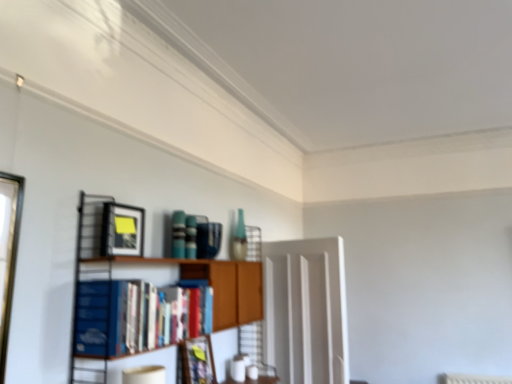
Question: Is blue hardcover book at left oriented towards matte black picture frame at upper left, which appears as the 2th picture frame when viewed from the back?

Choices:
 (A) no
 (B) yes

Answer: (A)

Question: Is blue hardcover book at left thinner than matte black picture frame at upper left, which appears as the 2th picture frame when viewed from the back?

Choices:
 (A) no
 (B) yes

Answer: (A)

Question: Considering the relative sizes of blue hardcover book at left and matte black picture frame at upper left, positioned as the 1th picture frame in left-to-right order, in the image provided, is blue hardcover book at left wider than matte black picture frame at upper left, positioned as the 1th picture frame in left-to-right order,?

Choices:
 (A) yes
 (B) no

Answer: (A)

Question: Does blue hardcover book at left lie behind matte black picture frame at upper left, positioned as the 1th picture frame in left-to-right order?

Choices:
 (A) no
 (B) yes

Answer: (A)

Question: Is blue hardcover book at left turned away from matte black picture frame at upper left, which is the 2th picture frame from right to left?

Choices:
 (A) yes
 (B) no

Answer: (B)

Question: From the image's perspective, is matte black picture frame at upper left, the 1th picture frame when ordered from front to back, positioned above or below wooden bookshelf at center?

Choices:
 (A) above
 (B) below

Answer: (A)

Question: From a real-world perspective, is matte black picture frame at upper left, positioned as the 1th picture frame in left-to-right order, above or below wooden bookshelf at center?

Choices:
 (A) above
 (B) below

Answer: (A)

Question: Is matte black picture frame at upper left, which appears as the 2th picture frame when viewed from the back, bigger or smaller than wooden bookshelf at center?

Choices:
 (A) small
 (B) big

Answer: (A)

Question: Considering their positions, is matte black picture frame at upper left, the 1th picture frame when ordered from front to back, located in front of or behind wooden bookshelf at center?

Choices:
 (A) front
 (B) behind

Answer: (B)

Question: Is point (206, 352) closer or farther from the camera than point (343, 382)?

Choices:
 (A) closer
 (B) farther

Answer: (A)

Question: From a real-world perspective, is matte black picture frame at center, the first picture frame ordered from the bottom, above or below transparent glass door at center?

Choices:
 (A) below
 (B) above

Answer: (A)

Question: In terms of width, does matte black picture frame at center, marked as the first picture frame in a right-to-left arrangement, look wider or thinner when compared to transparent glass door at center?

Choices:
 (A) thin
 (B) wide

Answer: (A)

Question: From the image's perspective, is matte black picture frame at center, marked as the first picture frame in a back-to-front arrangement, positioned above or below transparent glass door at center?

Choices:
 (A) below
 (B) above

Answer: (A)

Question: Considering the relative positions of wooden bookshelf at center and blue hardcover book at left in the image provided, is wooden bookshelf at center to the left or to the right of blue hardcover book at left?

Choices:
 (A) right
 (B) left

Answer: (A)

Question: From the image's perspective, is wooden bookshelf at center positioned above or below blue hardcover book at left?

Choices:
 (A) above
 (B) below

Answer: (B)